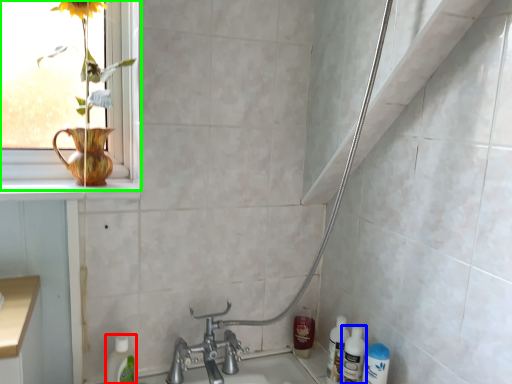
Question: Which object is the closest to the cleaning product (highlighted by a red box)? Choose among these: cleaning product (highlighted by a blue box) or window (highlighted by a green box).

Choices:
 (A) cleaning product
 (B) window

Answer: (B)